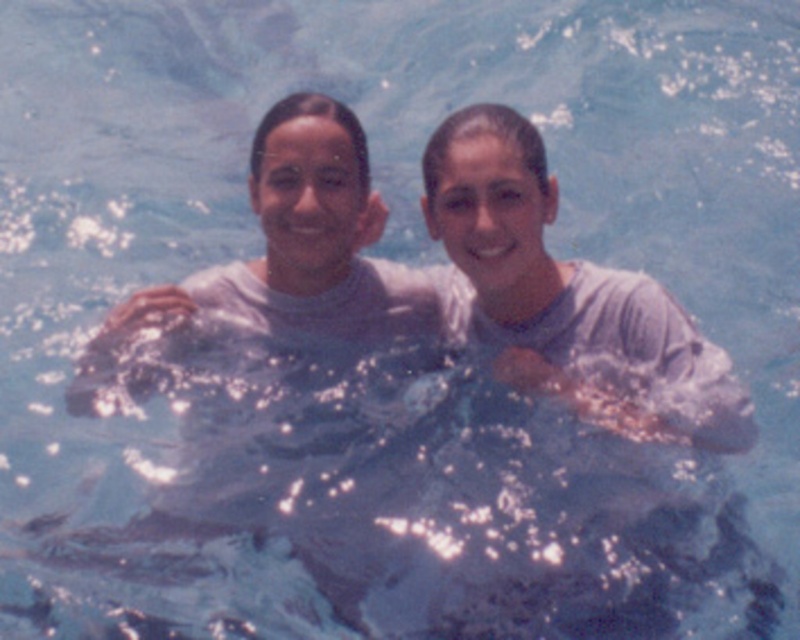
You are a photographer trying to capture the exact location of the gray matte shirt at center in the image. According to the coordinates provided, where would you focus your camera to ensure the shirt is centered in your shot?

The gray matte shirt at center is located at point coordinates (x=568, y=294), so focusing the camera at those coordinates would center the shirt in the shot.

You are a photographer trying to capture the perfect shot of the two individuals in the pool. You notice a point at coordinates point (458,275). What object is this point located on?

The point (458,275) is on white matte skin at center.